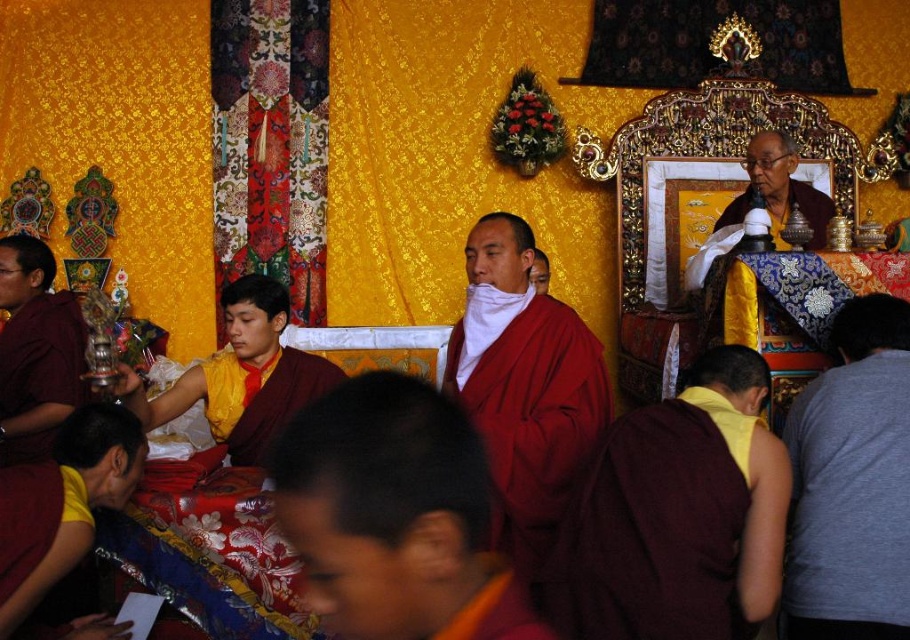
You are a visitor standing in the temple and want to take a photo of both the matte red robe at left and the yellow silk robe at center. Your camera has a maximum focus range of 7 meters. Can you capture both robes in the same photo without moving your position?

The matte red robe at left and yellow silk robe at center are 6.96 meters apart. Since the distance between them is within the camera maximum focus range of 7 meters, you can capture both robes in the same photo without moving your position.

In the temple scene, there are two robes visible. The matte red robe at left and the yellow silk robe at center. Which robe is positioned to the left of the other?

The matte red robe at left is to the left of the yellow silk robe at center.